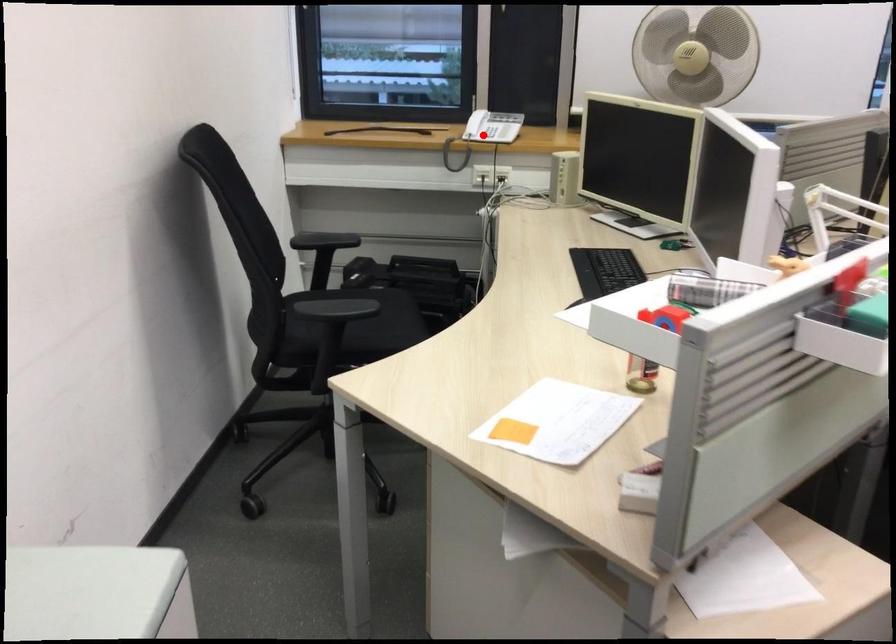
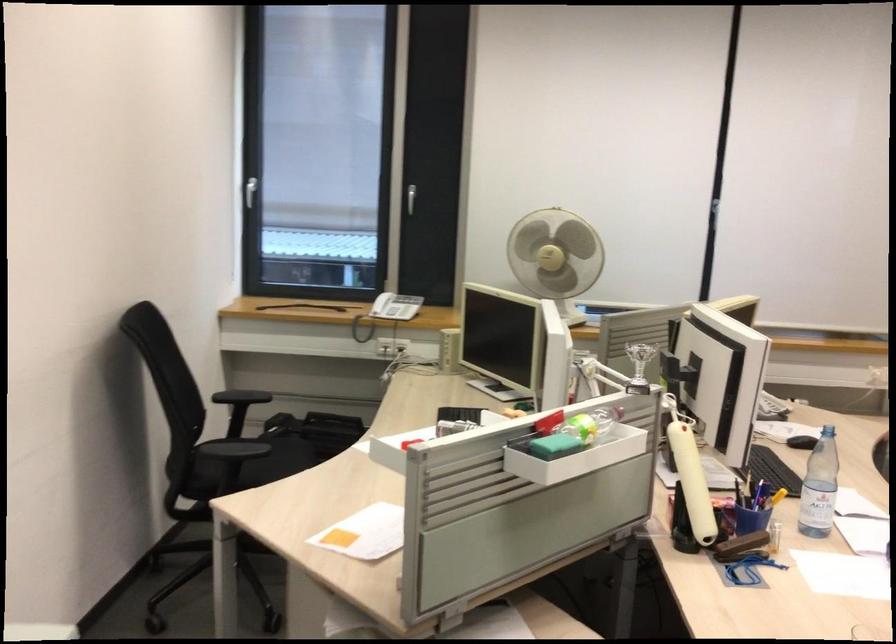
Question: I am providing you with two images of the same scene from different viewpoints. In image1, a red point is highlighted. Considering the same 3D point in image2, which of the following is correct?

Choices:
 (A) It is closer
 (B) It is farther

Answer: (B)